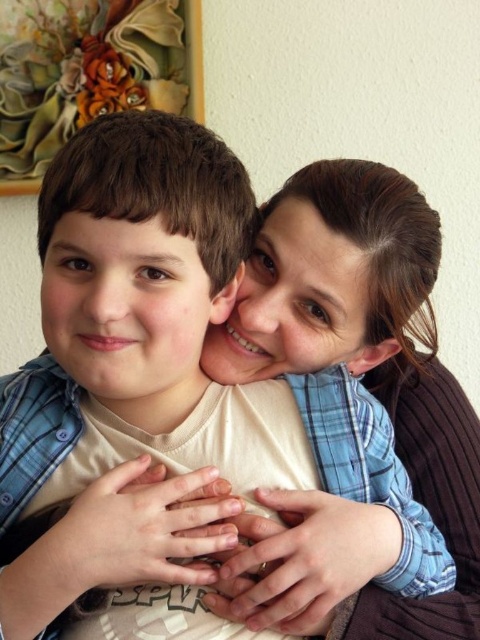
Is matte brown hair at upper center bigger than painted floral artwork at upper left?

Yes, matte brown hair at upper center is bigger than painted floral artwork at upper left.

Who is higher up, matte brown hair at upper center or painted floral artwork at upper left?

painted floral artwork at upper left

Does point (414, 445) lie in front of point (202, 48)?

Yes.

Where is `matte brown hair at upper center`? The image size is (480, 640). matte brown hair at upper center is located at coordinates (365, 353).